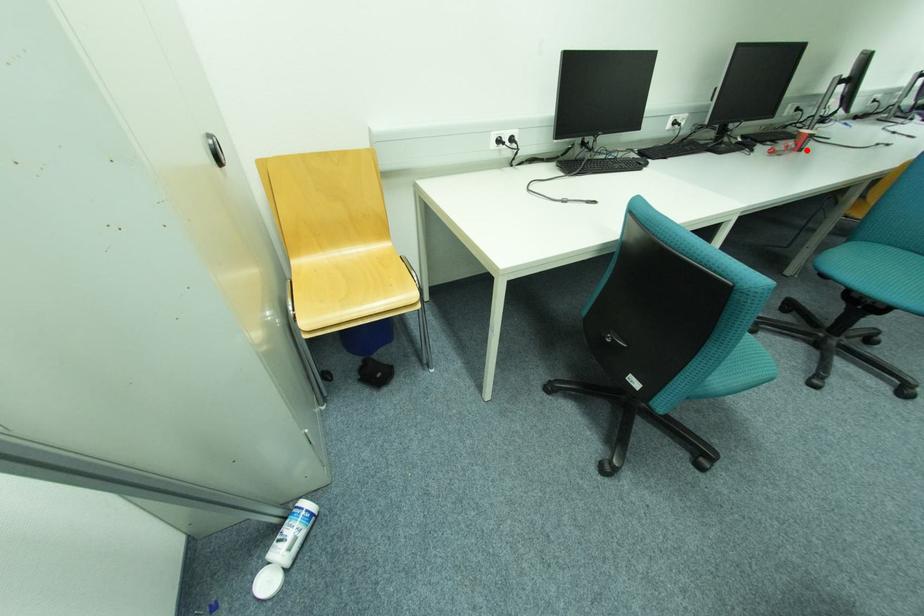
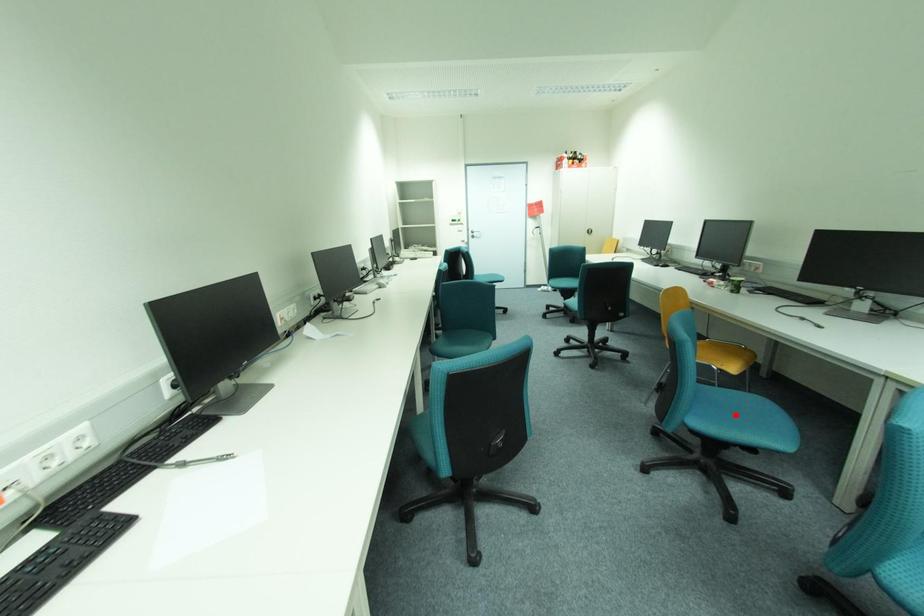
I am providing you with two images of the same scene from different viewpoints. A red point is marked on the first image and another point is marked on the second image. Is the red point in image1 aligned with the point shown in image2?

No